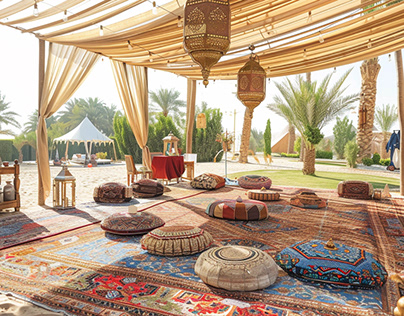
Locate an element on the screen. The width and height of the screenshot is (404, 316). lantern is located at coordinates (66, 194), (211, 21), (244, 90), (365, 115), (198, 121).